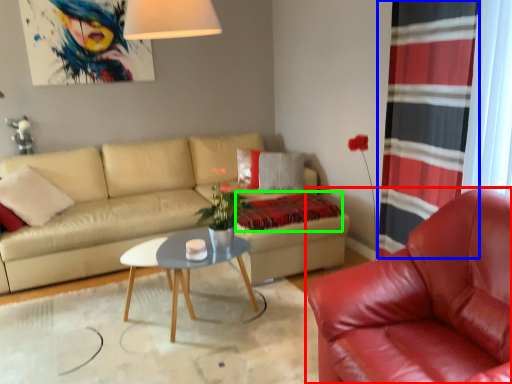
Question: Which object is the farthest from chair (highlighted by a red box)? Choose among these: curtain (highlighted by a blue box) or blanket (highlighted by a green box).

Choices:
 (A) curtain
 (B) blanket

Answer: (B)